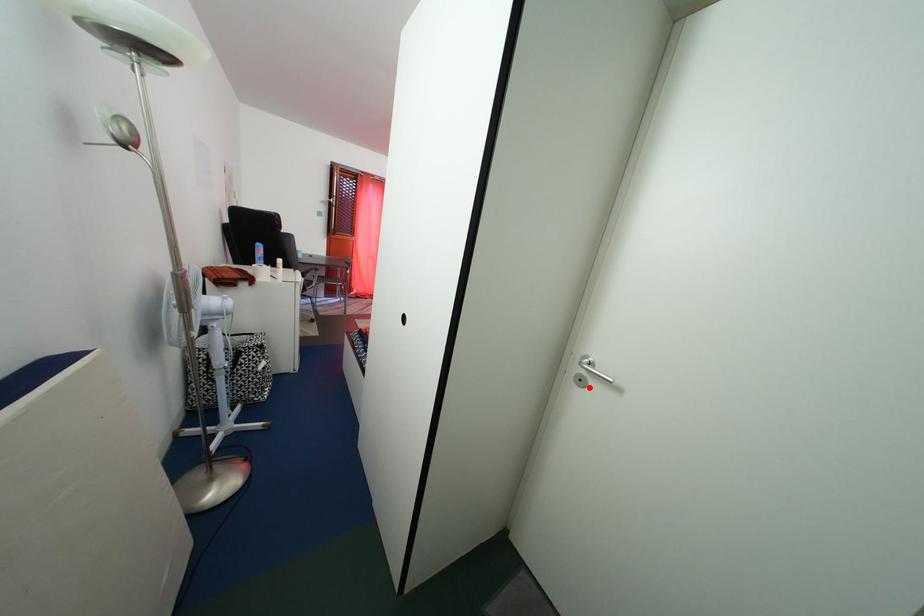
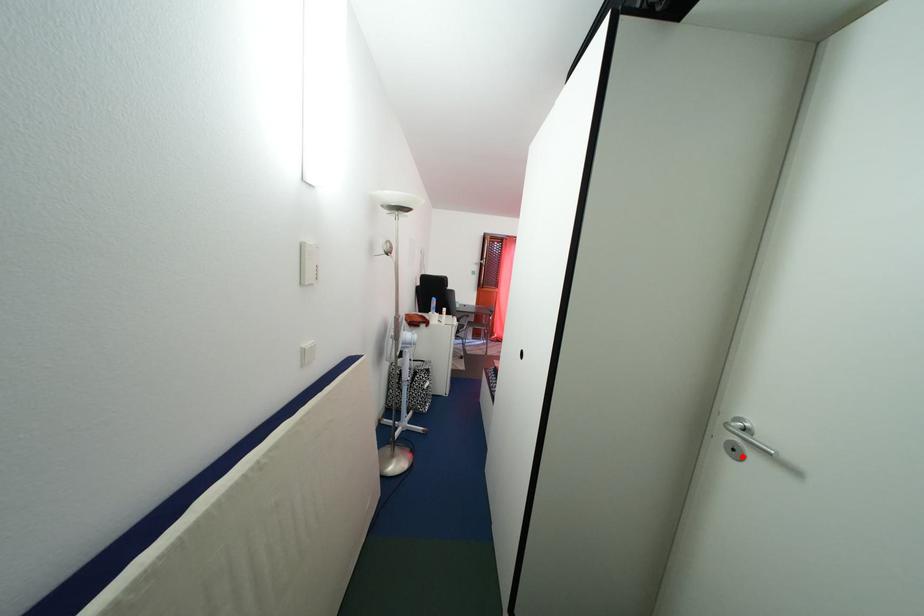
I am providing you with two images of the same scene from different viewpoints. A red point is marked on the first image and another point is marked on the second image. Are the points marked in image1 and image2 representing the same 3D position?

Yes